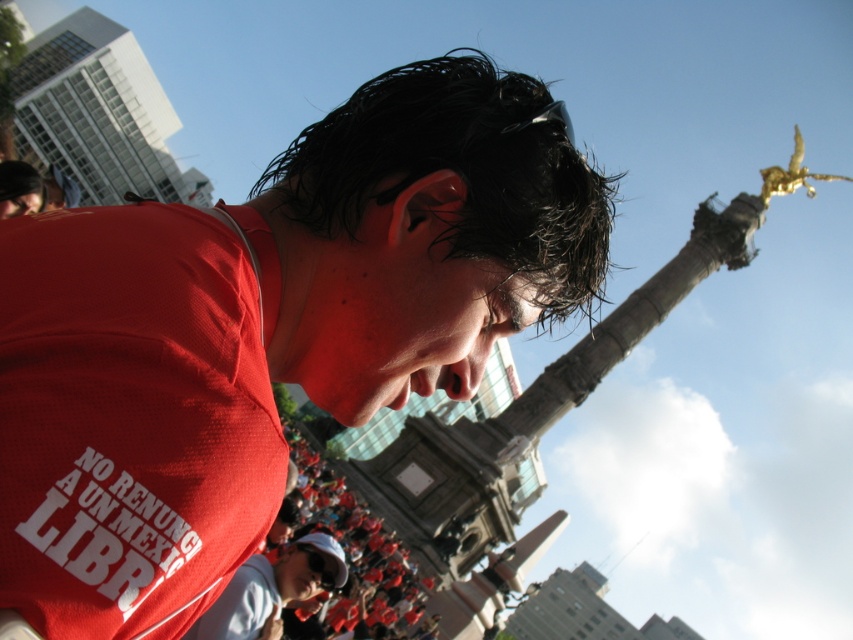
You are a photographer at the event and want to capture a clear photo of the matte white cap at lower center without the matte red jersey at center blocking it. What adjustment should you make to your camera angle?

To avoid the matte red jersey at center blocking the matte white cap at lower center, you should adjust your camera angle to look downward since the matte red jersey at center is positioned over the matte white cap at lower center.

You are a photographer at the event and want to capture a closeup of the matte red jersey at center without the matte white cap at lower center appearing in the shot. Is this possible given their sizes?

The matte red jersey at center is wider than the matte white cap at lower center, so if positioned correctly, it might be possible to frame the shot to exclude the cap by focusing solely on the jersey.

You are a photographer trying to capture the most representative image of the crowd at this event. You notice the point at coordinates (267, 332). What object is located there?

The point at coordinates (267, 332) corresponds to the matte red jersey at center.